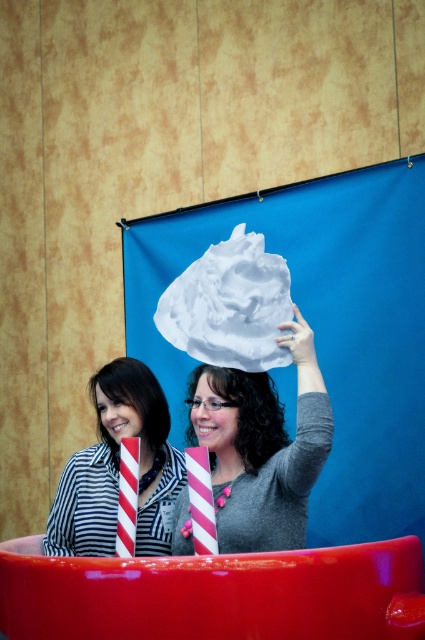
Looking at this image, you are standing at the origin point in the image. Which of the two points, point (x=317, y=472) or point (x=102, y=534), is closer to you?

Point (x=317, y=472) is in front of point (x=102, y=534), so it is closer to you.

Consider the image. You are standing in front of the table with the large red bowl. You need to place a signature on a document. Where should you look to find the white matte paper at upper center?

The white matte paper at upper center is located at point (261, 445), so you should look there to find it.